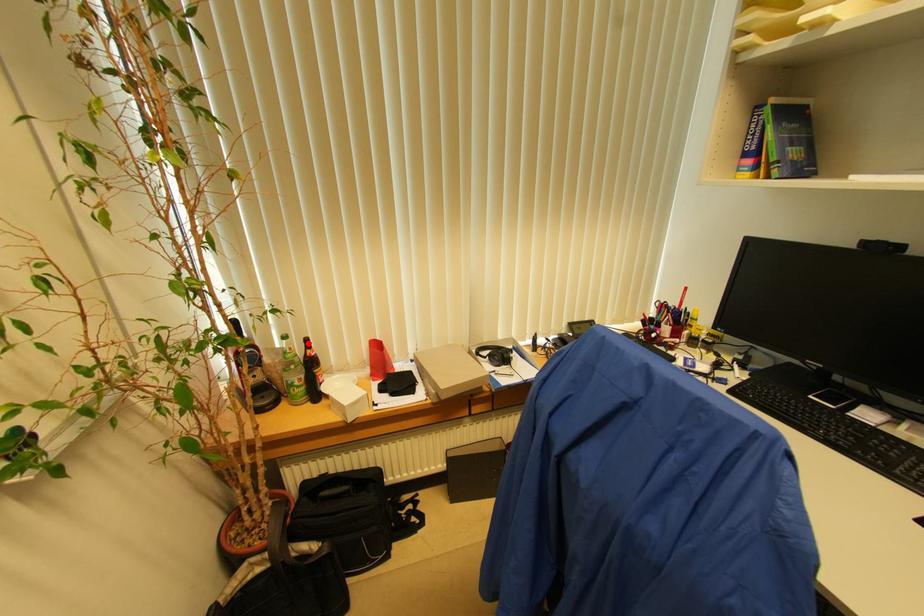
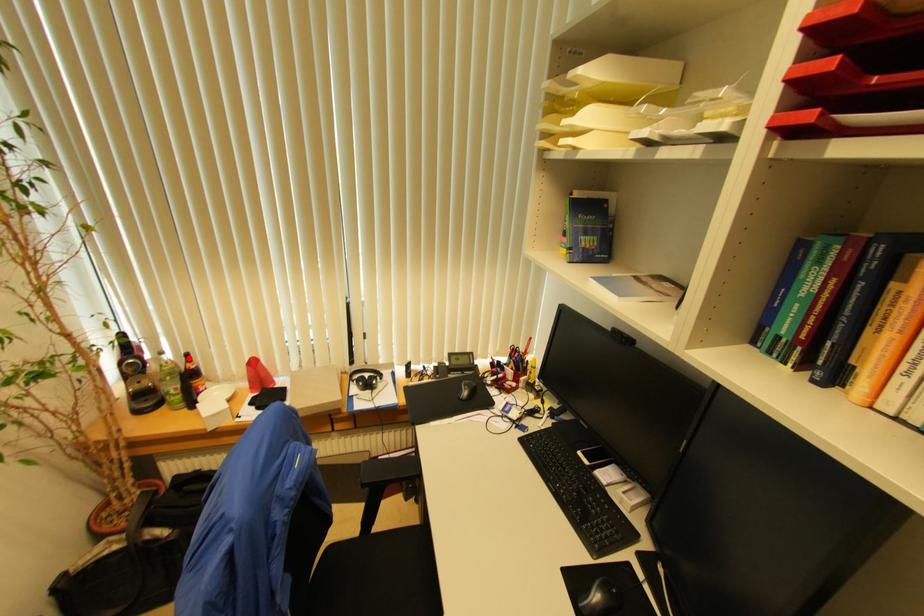
I am providing you with two images of the same scene from different viewpoints. A red point is marked on the first image and another point is marked on the second image. Does the point marked in image1 correspond to the same location as the one in image2?

Yes